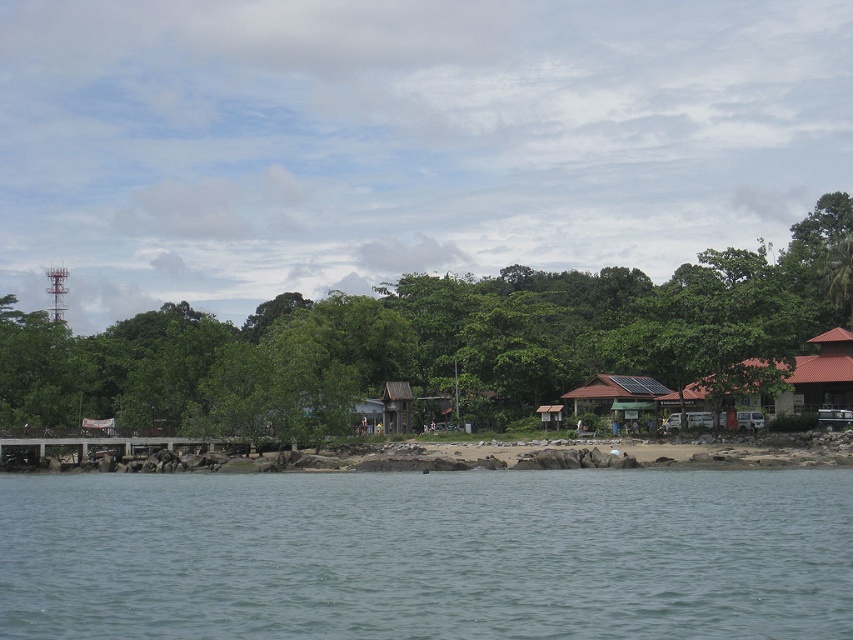
You are standing on the brown wooden dock at lower left and want to reach the brown corrugated metal hut at right. According to the scene, which direction should you move to get there?

The brown corrugated metal hut at right is positioned over the brown wooden dock at lower left, so you should move towards the right direction to reach it.